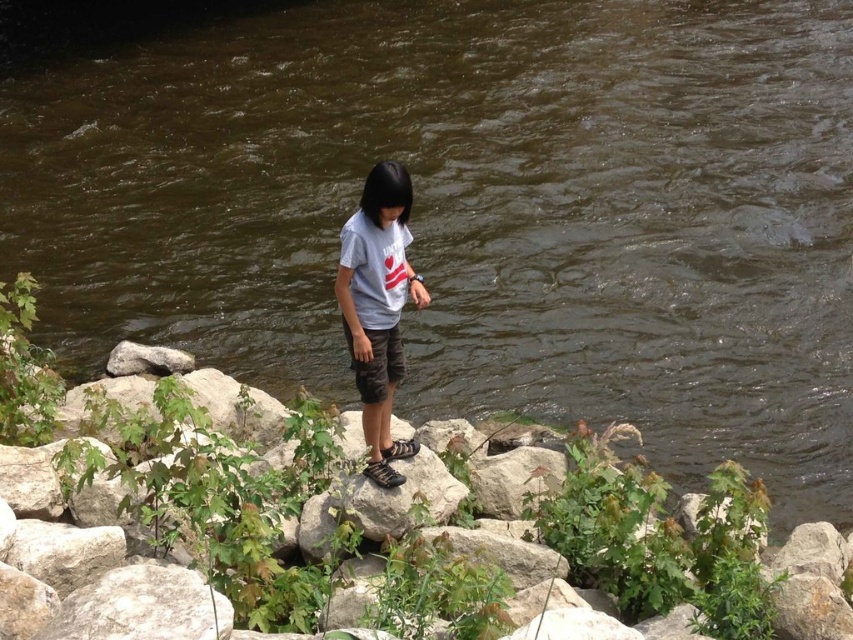
You are standing at point [550,525] and want to cross the river to the opposite bank. The river flows from the north to the south. If you swim directly towards the east, will you end up downstream or upstream of your starting point?

Since the river flows from north to south, swimming directly east would take you across the current. However, the river flow would carry you downstream in the direction of the current. Therefore, you would end up downstream of your starting point.

You are a hiker who wants to cross the river. You see the brown stone at center and the brown cotton shorts at center. Which object is closer to the water surface?

The brown stone at center is below brown cotton shorts at center, so the brown stone at center is closer to the water surface.